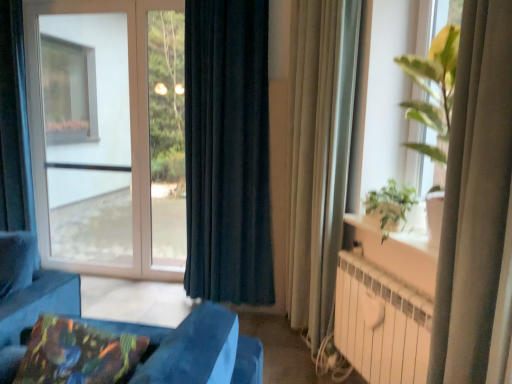
Question: Can you confirm if beige fabric curtain at right, the 2th curtain when ordered from back to front, is positioned to the left of beige sheer curtain at right, the first curtain from the front?

Choices:
 (A) yes
 (B) no

Answer: (A)

Question: Does beige fabric curtain at right, which appears as the 2th curtain when viewed from the front, have a lesser width compared to beige sheer curtain at right, the first curtain from the front?

Choices:
 (A) yes
 (B) no

Answer: (A)

Question: Are beige fabric curtain at right, the second curtain when ordered from left to right, and beige sheer curtain at right, the third curtain from the back, located far from each other?

Choices:
 (A) yes
 (B) no

Answer: (A)

Question: From the image's perspective, does beige fabric curtain at right, the 2th curtain when ordered from back to front, appear higher than beige sheer curtain at right, the first curtain from the front?

Choices:
 (A) no
 (B) yes

Answer: (B)

Question: Does beige fabric curtain at right, which is the 2th curtain in right-to-left order, come behind beige sheer curtain at right, the first curtain from the front?

Choices:
 (A) no
 (B) yes

Answer: (B)

Question: Would you say transparent glass window at left, the first window in the left-to-right sequence, is inside or outside multicolored fabric pillow at lower left?

Choices:
 (A) outside
 (B) inside

Answer: (A)

Question: In the image, is transparent glass window at left, which is the second window from right to left, positioned in front of or behind multicolored fabric pillow at lower left?

Choices:
 (A) front
 (B) behind

Answer: (B)

Question: From a real-world perspective, relative to multicolored fabric pillow at lower left, is transparent glass window at left, the first window in the left-to-right sequence, vertically above or below?

Choices:
 (A) above
 (B) below

Answer: (A)

Question: Does point (42, 23) appear closer or farther from the camera than point (36, 360)?

Choices:
 (A) farther
 (B) closer

Answer: (A)

Question: Do you think beige fabric curtain at right, the second curtain when ordered from left to right, is within multicolored fabric pillow at lower left, or outside of it?

Choices:
 (A) inside
 (B) outside

Answer: (B)

Question: From a real-world perspective, is beige fabric curtain at right, the 2th curtain when ordered from back to front, positioned above or below multicolored fabric pillow at lower left?

Choices:
 (A) below
 (B) above

Answer: (B)

Question: Is beige fabric curtain at right, which appears as the 2th curtain when viewed from the front, taller or shorter than multicolored fabric pillow at lower left?

Choices:
 (A) short
 (B) tall

Answer: (B)

Question: Relative to multicolored fabric pillow at lower left, is beige fabric curtain at right, the second curtain when ordered from left to right, in front or behind?

Choices:
 (A) front
 (B) behind

Answer: (B)

Question: Is white metallic radiator at lower right taller or shorter than green leafy plant at upper right, positioned as the first window in front-to-back order?

Choices:
 (A) short
 (B) tall

Answer: (A)

Question: Is white metallic radiator at lower right to the left or to the right of green leafy plant at upper right, the 2th window viewed from the left, in the image?

Choices:
 (A) right
 (B) left

Answer: (B)